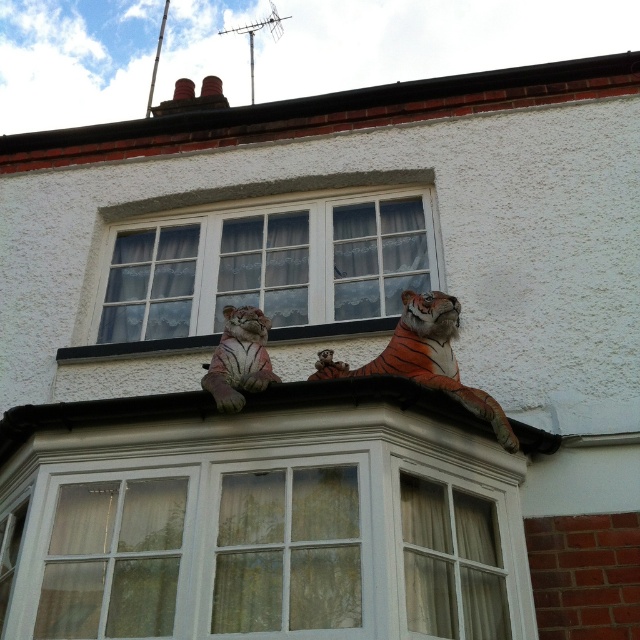
At what (x,y) coordinates should I click in order to perform the action: click on white textured window at center. Please return your answer as a coordinate pair (x, y). This screenshot has width=640, height=640. Looking at the image, I should click on [x=266, y=269].

Between white textured window at center and white textured roof at upper center, which one is positioned lower?

Positioned lower is white textured window at center.

Locate an element on the screen. white textured window at center is located at coordinates (266, 269).

You are a GUI agent. You are given a task and a screenshot of the screen. Output one action in this format:
    pyautogui.click(x=<x>, y=<y>)
    Task: Click on the white textured window at center
    The width and height of the screenshot is (640, 640).
    Given the screenshot: What is the action you would take?
    pyautogui.click(x=266, y=269)

Can you confirm if orange textured tiger at upper center is bigger than speckled stone tiger at center?

Yes.

This screenshot has width=640, height=640. What are the coordinates of `orange textured tiger at upper center` in the screenshot? It's located at (426, 358).

Is point (506, 445) closer to camera compared to point (262, 349)?

Yes, point (506, 445) is closer to viewer.

The height and width of the screenshot is (640, 640). I want to click on orange textured tiger at upper center, so click(426, 358).

Image resolution: width=640 pixels, height=640 pixels. I want to click on white textured roof at upper center, so (x=324, y=113).

Measure the distance from white textured roof at upper center to orange textured tiger at upper center.

The distance of white textured roof at upper center from orange textured tiger at upper center is 10.15 meters.

Is point (632, 58) farther from viewer compared to point (321, 369)?

Yes.

This screenshot has height=640, width=640. Identify the location of white textured roof at upper center. (324, 113).